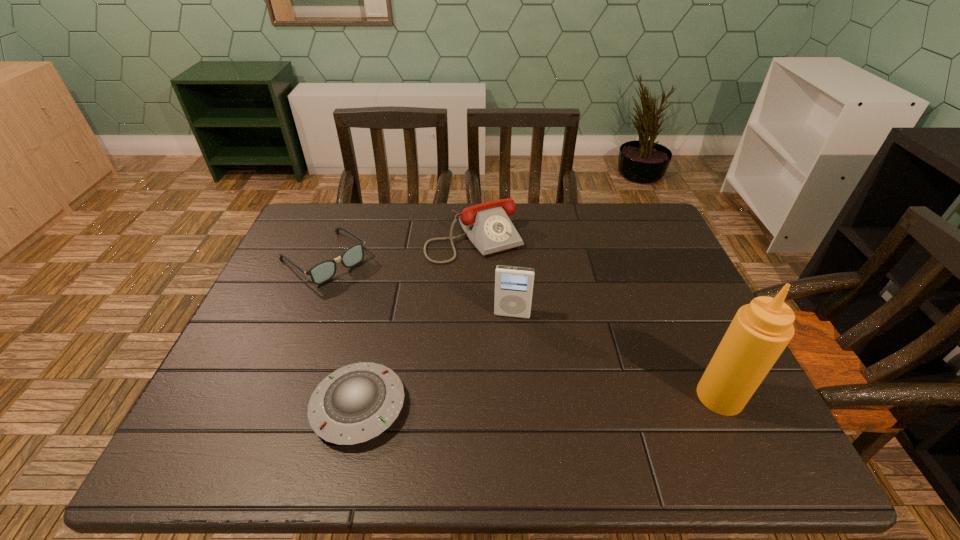
Identify the location of vacant space situated on the front-facing side of the iPod. (502, 385).

Where is `blank space located 0.130m on the front-facing side of the iPod`? Image resolution: width=960 pixels, height=540 pixels. blank space located 0.130m on the front-facing side of the iPod is located at coordinates (505, 362).

In order to click on free spot located 0.090m on the dial of the telephone in this screenshot , I will do `click(508, 282)`.

Find the location of `vacant area situated on the dial of the telephone`. vacant area situated on the dial of the telephone is located at coordinates (524, 307).

Where is `free space located on the dial of the telephone`? Image resolution: width=960 pixels, height=540 pixels. free space located on the dial of the telephone is located at coordinates (561, 361).

Image resolution: width=960 pixels, height=540 pixels. Find the location of `free space located 0.080m on the face of the second shortest object`. free space located 0.080m on the face of the second shortest object is located at coordinates (365, 294).

Locate an element on the screen. free spot located 0.280m on the face of the second shortest object is located at coordinates (414, 336).

At what (x,y) coordinates should I click in order to perform the action: click on blank area located 0.140m on the face of the second shortest object. Please return your answer as a coordinate pair (x, y). The width and height of the screenshot is (960, 540). Looking at the image, I should click on (379, 306).

This screenshot has width=960, height=540. Find the location of `telephone at the far edge`. telephone at the far edge is located at coordinates (487, 225).

Image resolution: width=960 pixels, height=540 pixels. Find the location of `spectacles that is positioned at the far edge`. spectacles that is positioned at the far edge is located at coordinates (323, 271).